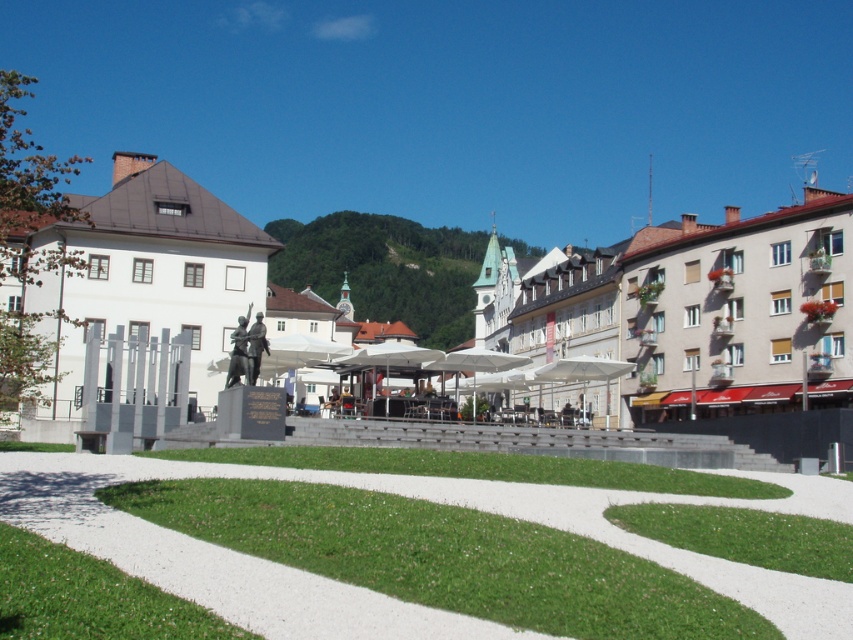
Can you confirm if polished stone statue at center is smaller than green grass at center?

No.

Does polished stone statue at center have a greater height compared to green grass at center?

Yes.

Does point (491, 317) lie in front of point (260, 609)?

No, (491, 317) is behind (260, 609).

The height and width of the screenshot is (640, 853). In order to click on polished stone statue at center in this screenshot , I will do `click(695, 314)`.

Is green grass at center to the right of bronze statue at center from the viewer's perspective?

Correct, you'll find green grass at center to the right of bronze statue at center.

Between point (434, 492) and point (242, 336), which one is positioned behind?

The point (242, 336) is more distant.

Is point (437, 612) closer to camera compared to point (236, 362)?

Yes, point (437, 612) is in front of point (236, 362).

Where is `green grass at center`? The image size is (853, 640). green grass at center is located at coordinates (375, 592).

Who is higher up, polished stone statue at center or bronze statue at center?

polished stone statue at center is higher up.

What do you see at coordinates (695, 314) in the screenshot? This screenshot has width=853, height=640. I see `polished stone statue at center` at bounding box center [695, 314].

Is point (543, 352) positioned before point (238, 337)?

No, it is not.

The height and width of the screenshot is (640, 853). I want to click on polished stone statue at center, so click(695, 314).